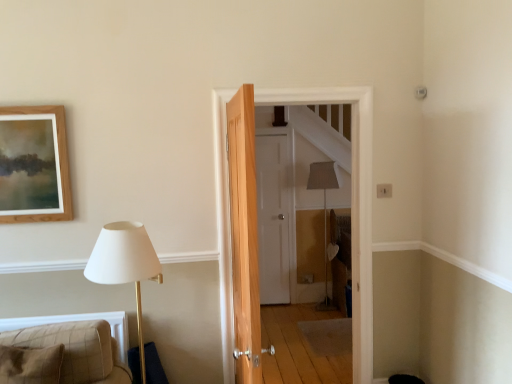
Question: From a real-world perspective, is white matte door at center, which is the second door in front-to-back order, physically located above or below plaid fabric cushion at lower left?

Choices:
 (A) above
 (B) below

Answer: (A)

Question: Is white matte door at center, which is the second door in front-to-back order, taller or shorter than plaid fabric cushion at lower left?

Choices:
 (A) tall
 (B) short

Answer: (A)

Question: Which object is the farthest from the white matte door at center, which is the second door in front-to-back order?

Choices:
 (A) plaid fabric cushion at lower left
 (B) wooden door at center, placed as the 1th door when sorted from front to back

Answer: (A)

Question: Based on their relative distances, which object is nearer to the plaid fabric cushion at lower left?

Choices:
 (A) wooden door at center, which is the second door from back to front
 (B) white matte door at center, which appears as the 1th door when viewed from the back

Answer: (A)